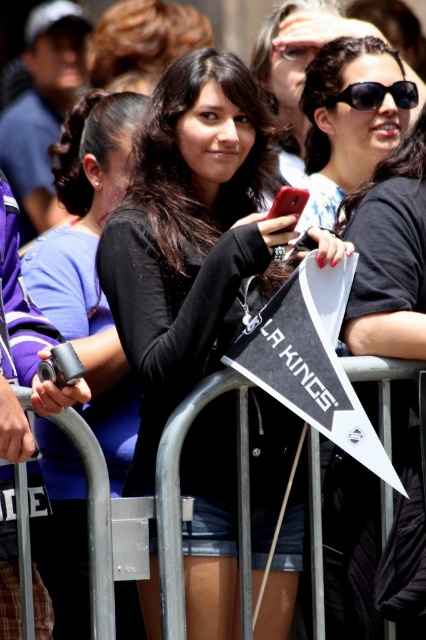
Question: Which of the following is the closest to the observer?

Choices:
 (A) black matte shirt at center
 (B) matte black sunglasses at upper right
 (C) black matte sunglasses at upper right
 (D) silver metallic rail at center

Answer: (D)

Question: Among these points, which one is farthest from the camera?

Choices:
 (A) (345, 131)
 (B) (46, 266)
 (C) (229, 168)
 (D) (345, 99)

Answer: (A)

Question: Which of the following is the farthest from the observer?

Choices:
 (A) silver metallic rail at center
 (B) sunglasses at center
 (C) matte black phone at center
 (D) black matte shirt at center

Answer: (B)

Question: Does matte black phone at center appear on the right side of black matte sunglasses at upper right?

Choices:
 (A) yes
 (B) no

Answer: (B)

Question: Is silver metallic rail at center bigger than sunglasses at center?

Choices:
 (A) yes
 (B) no

Answer: (A)

Question: Can you confirm if silver metallic rail at center is positioned to the right of matte black sunglasses at upper right?

Choices:
 (A) no
 (B) yes

Answer: (A)